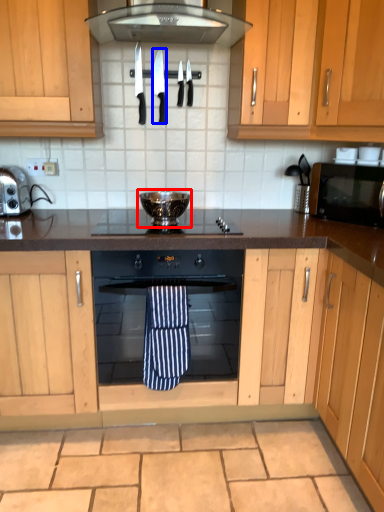
Question: Which of the following is the farthest to the observer, appliance (highlighted by a red box) or knife (highlighted by a blue box)?

Choices:
 (A) appliance
 (B) knife

Answer: (B)